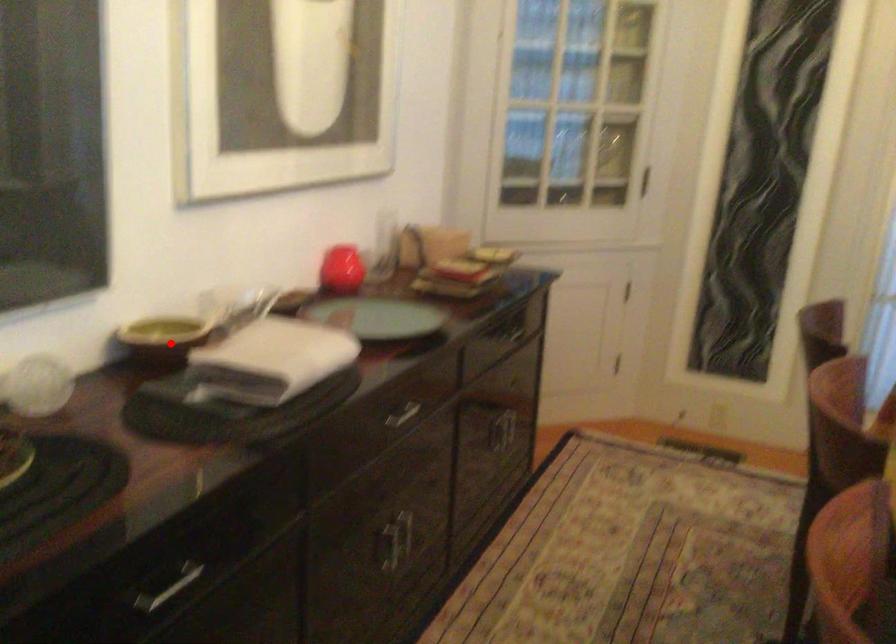
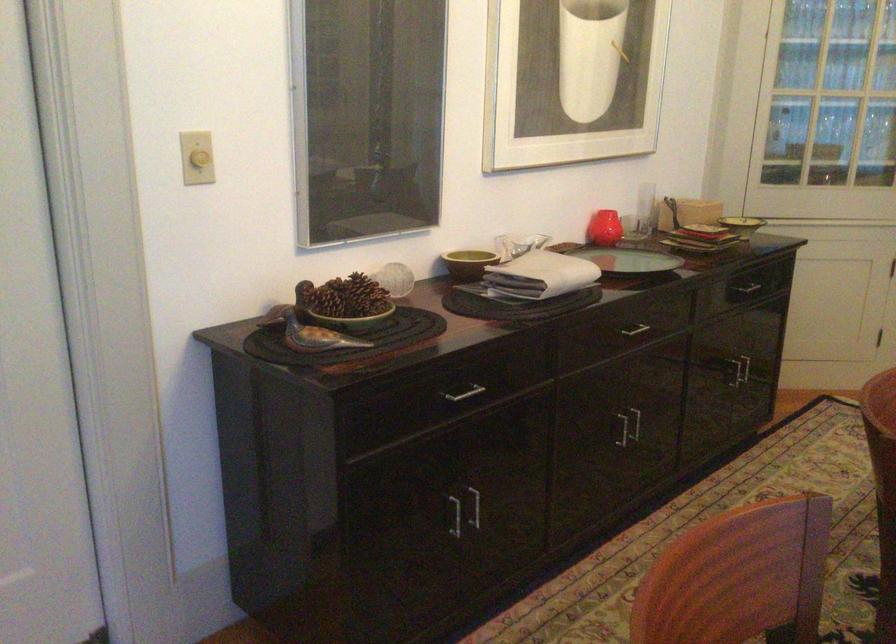
Question: I am providing you with two images of the same scene from different viewpoints. Image1 has a red point marked. In image2, the corresponding 3D location appears at what relative position? Reply with the corresponding letter.

Choices:
 (A) Closer
 (B) Farther

Answer: (B)